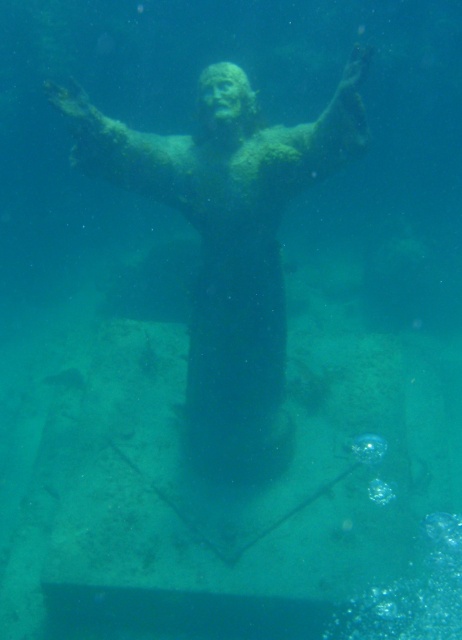
Question: Does greenish stone statue at center have a larger size compared to transparent gel-like bubble at center?

Choices:
 (A) no
 (B) yes

Answer: (B)

Question: Does greenish stone statue at center have a smaller size compared to transparent gel-like bubble at center?

Choices:
 (A) no
 (B) yes

Answer: (A)

Question: Among these points, which one is farthest from the camera?

Choices:
 (A) (370, 461)
 (B) (216, 212)

Answer: (A)

Question: Which point is farther from the camera taking this photo?

Choices:
 (A) (295, 179)
 (B) (370, 436)

Answer: (B)

Question: Is the position of greenish stone statue at center less distant than that of transparent gel-like bubble at center?

Choices:
 (A) no
 (B) yes

Answer: (B)